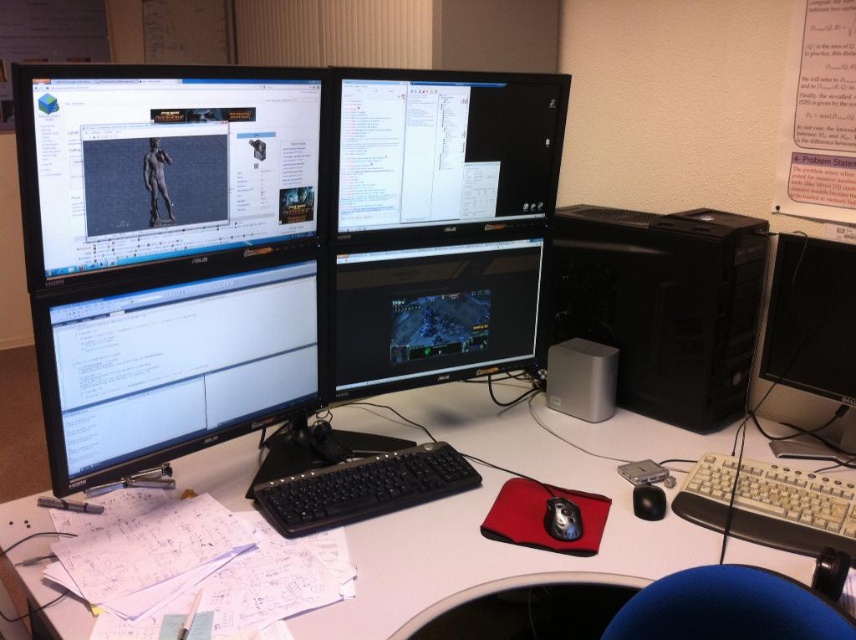
You are a technician who needs to reach the matte black monitor at upper left to adjust its settings. Your arm can extend 36 inches. Can you reach it?

The matte black monitor at upper left is 38.86 inches away from the camera, which is beyond your arm extension of 36 inches. You cannot reach it.

Looking at this image, you are setting up a new workspace and want to place a black plastic keyboard at center on the desk. However, there is already a black glossy monitor at center occupying the space. Can the keyboard be placed to the right of the monitor without overlapping?

The black glossy monitor at center is wider than the black plastic keyboard at center. Therefore, placing the keyboard to the right of the monitor might still be possible, but the monitor takes up more horizontal space, so ensure there is enough desk space to accommodate both items side by side.

You are a technician who needs to reach both points in the image. Which point, point (245, 164) or point (526, 330), is closer to you?

Point (245, 164) is closer to the viewer than point (526, 330).